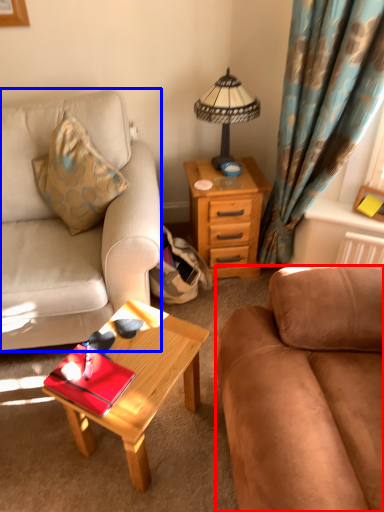
Question: Among these objects, which one is farthest to the camera, studio couch (highlighted by a red box) or studio couch (highlighted by a blue box)?

Choices:
 (A) studio couch
 (B) studio couch

Answer: (B)